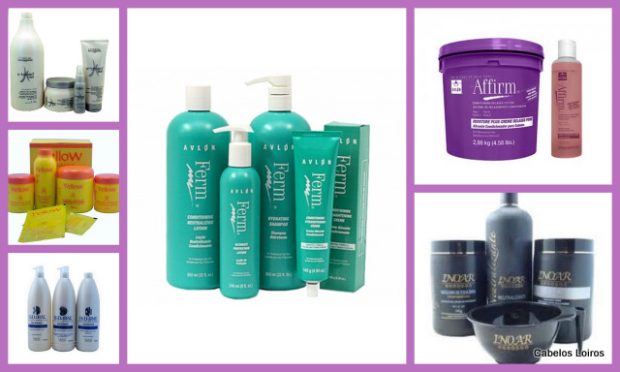
You are a GUI agent. You are given a task and a screenshot of the screen. Output one action in this format:
    pyautogui.click(x=<x>, y=<y>)
    Task: Click on the hair products in the middle box
    The image size is (620, 372).
    Given the screenshot: What is the action you would take?
    pyautogui.click(x=198, y=170), pyautogui.click(x=242, y=207), pyautogui.click(x=283, y=188), pyautogui.click(x=314, y=207), pyautogui.click(x=346, y=202)